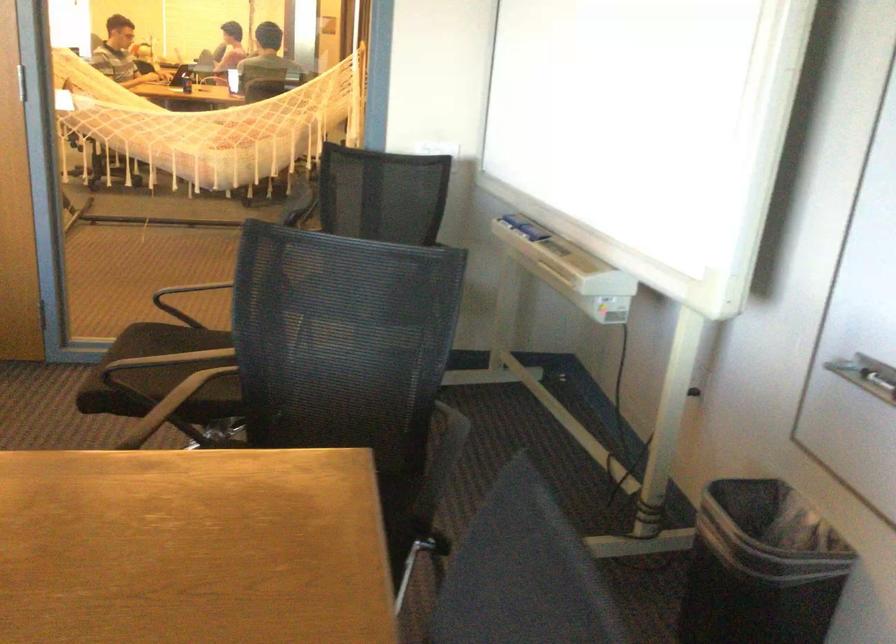
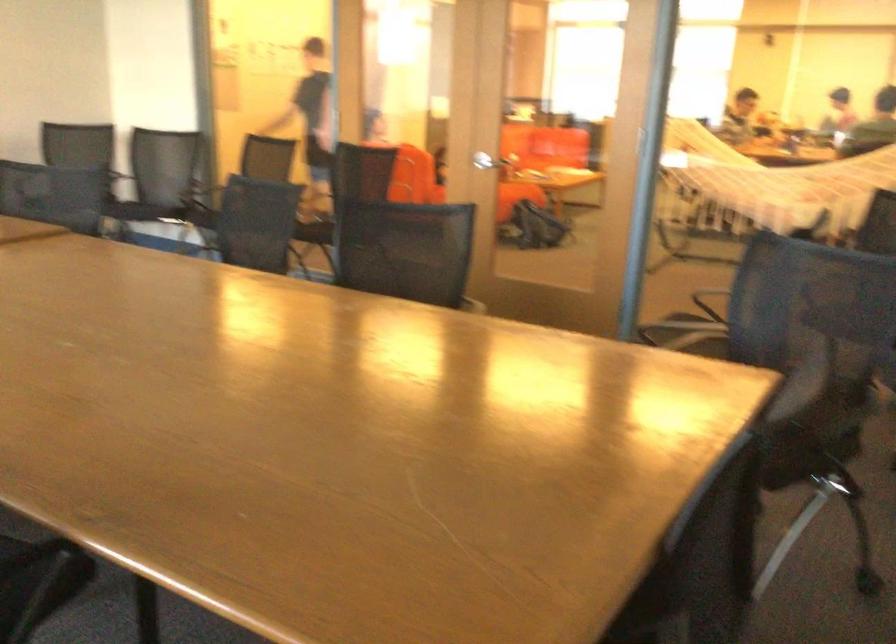
The point at (392, 516) is marked in the first image. Where is the corresponding point in the second image?

(803, 453)